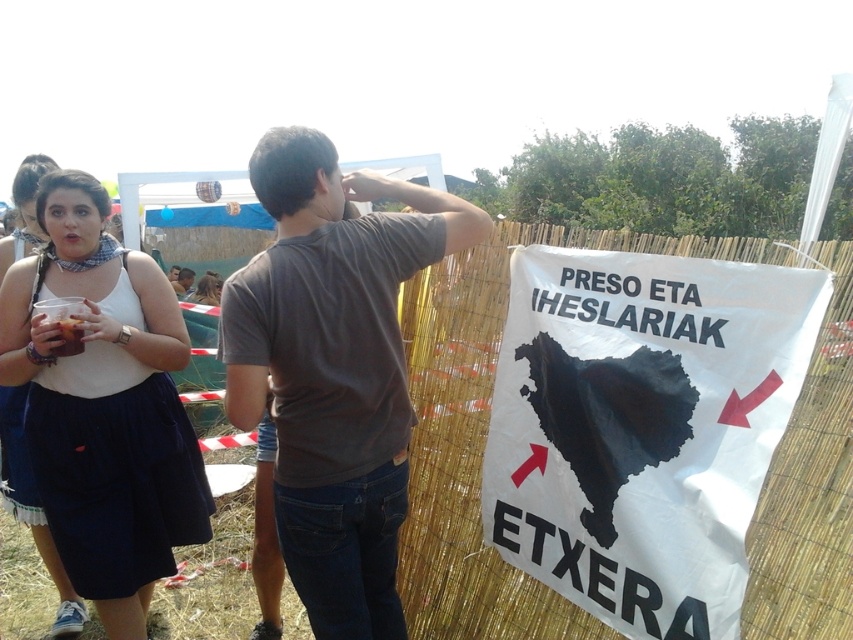
Question: Which point is closer to the camera taking this photo?

Choices:
 (A) (9, 474)
 (B) (106, 307)
 (C) (172, 285)

Answer: (B)

Question: Which object appears farthest from the camera in this image?

Choices:
 (A) dark gray t-shirt at center
 (B) matte white scarf at upper left
 (C) white cotton tank top at left

Answer: (B)

Question: From the image, what is the correct spatial relationship of dark gray t-shirt at center in relation to matte brown shirt at center?

Choices:
 (A) right
 (B) left

Answer: (A)

Question: Can you confirm if white fabric top at left is positioned below matte brown shirt at center?

Choices:
 (A) yes
 (B) no

Answer: (A)

Question: Among these objects, which one is farthest from the camera?

Choices:
 (A) matte brown shirt at center
 (B) dark gray t-shirt at center
 (C) matte white scarf at upper left

Answer: (A)

Question: Can you confirm if white fabric top at left is positioned to the right of matte white scarf at upper left?

Choices:
 (A) no
 (B) yes

Answer: (B)